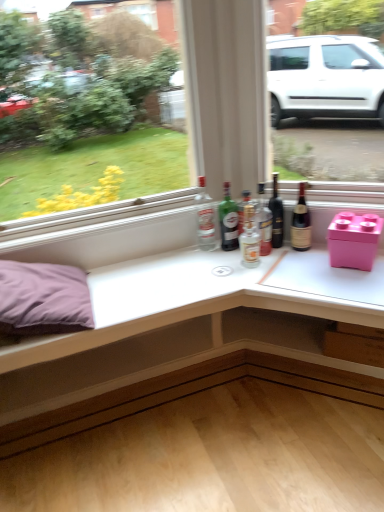
Image resolution: width=384 pixels, height=512 pixels. Find the location of `vacant space to the left of clear glass bottle at center, which is the first bottle in left-to-right order`. vacant space to the left of clear glass bottle at center, which is the first bottle in left-to-right order is located at coordinates (175, 254).